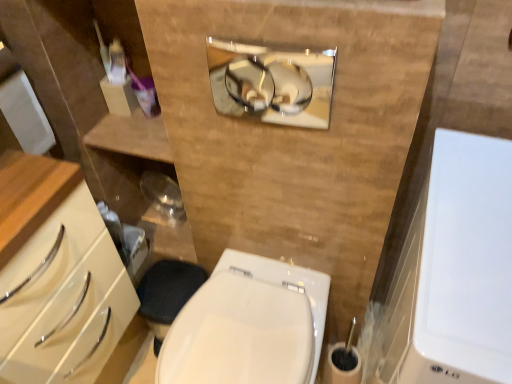
Question: In terms of height, does white glossy bidet at center look taller or shorter compared to white glossy medicine cabinet at right, the second medicine cabinet viewed from the left?

Choices:
 (A) short
 (B) tall

Answer: (A)

Question: Is white glossy bidet at center inside or outside of white glossy medicine cabinet at right, arranged as the first medicine cabinet when viewed from the front?

Choices:
 (A) inside
 (B) outside

Answer: (B)

Question: Which is farther from the white glossy bidet at center?

Choices:
 (A) white glossy medicine cabinet at right, marked as the 2th medicine cabinet in a top-to-bottom arrangement
 (B) polished chrome mirror at upper center, which appears as the 1th medicine cabinet when viewed from the back

Answer: (B)

Question: Which is nearer to the white glossy bidet at center?

Choices:
 (A) white glossy medicine cabinet at right, arranged as the first medicine cabinet when viewed from the front
 (B) polished chrome mirror at upper center, which appears as the 1th medicine cabinet when viewed from the back

Answer: (A)